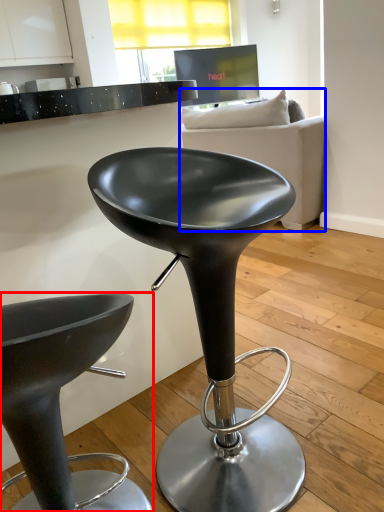
Question: Among these objects, which one is nearest to the camera, stool (highlighted by a red box) or studio couch (highlighted by a blue box)?

Choices:
 (A) stool
 (B) studio couch

Answer: (A)